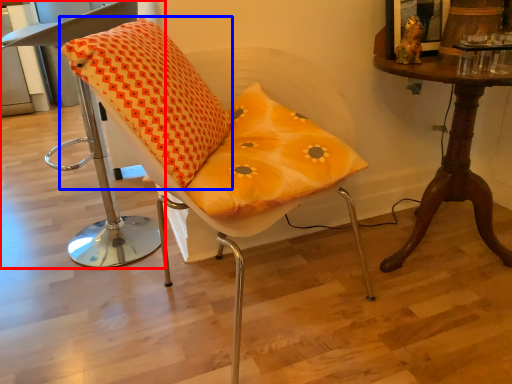
Question: Which of the following is the farthest to the observer, chair (highlighted by a red box) or throw pillow (highlighted by a blue box)?

Choices:
 (A) chair
 (B) throw pillow

Answer: (A)